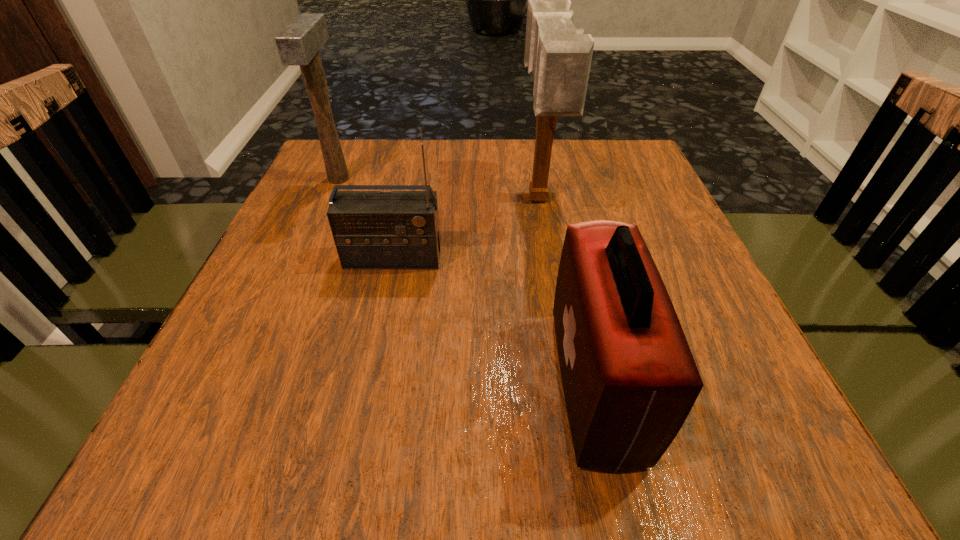
Where is `vacant space located on the side of the first aid kit with the cross symbol`? vacant space located on the side of the first aid kit with the cross symbol is located at coordinates (459, 384).

The width and height of the screenshot is (960, 540). In order to click on object situated at the near edge in this screenshot , I will do `click(629, 378)`.

The width and height of the screenshot is (960, 540). I want to click on mallet at the left edge, so click(299, 43).

The height and width of the screenshot is (540, 960). What are the coordinates of `radio receiver positioned at the left edge` in the screenshot? It's located at (371, 229).

Where is `object that is at the far left corner`? The image size is (960, 540). object that is at the far left corner is located at coordinates (299, 43).

The image size is (960, 540). What are the coordinates of `vacant space at the far edge of the desktop` in the screenshot? It's located at (479, 157).

Image resolution: width=960 pixels, height=540 pixels. Find the location of `free space at the near edge`. free space at the near edge is located at coordinates (300, 467).

Find the location of a particular element. vacant point at the left edge is located at coordinates (196, 396).

Where is `vacant space at the right edge of the desktop`? This screenshot has height=540, width=960. vacant space at the right edge of the desktop is located at coordinates (651, 239).

At what (x,y) coordinates should I click in order to perform the action: click on free space at the far right corner of the desktop. Please return your answer as a coordinate pair (x, y). Looking at the image, I should click on (592, 180).